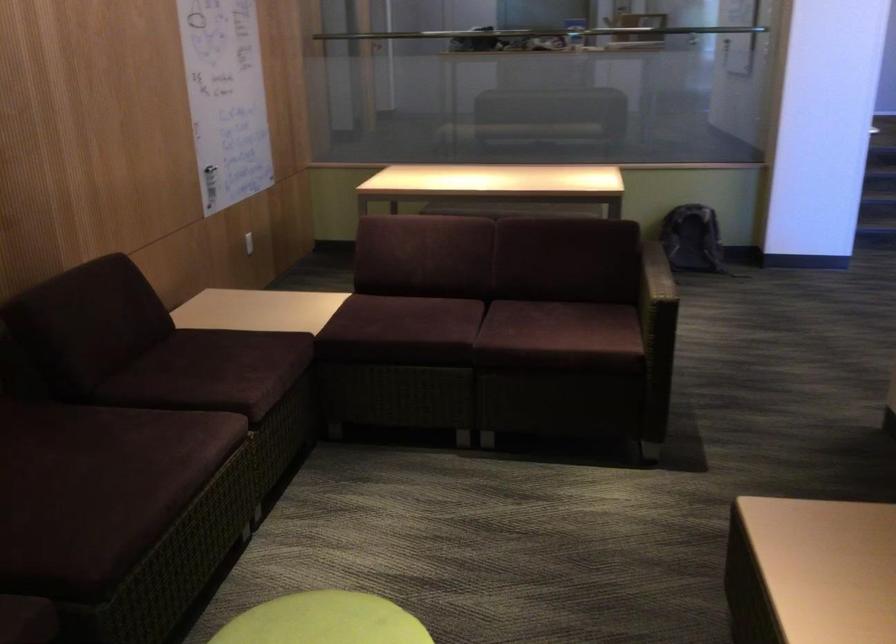
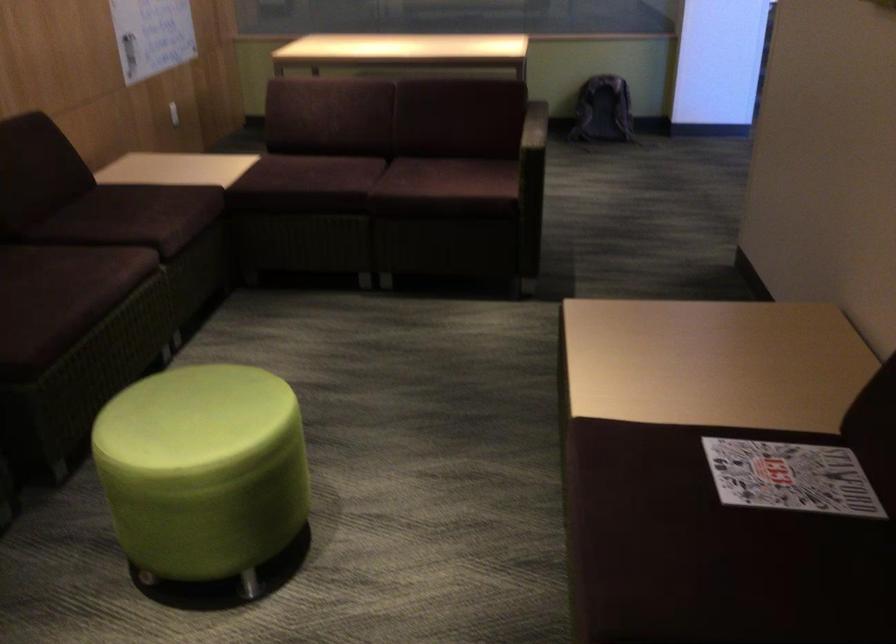
In the second image, find the point that corresponds to pixel 660 290 in the first image.

(533, 138)